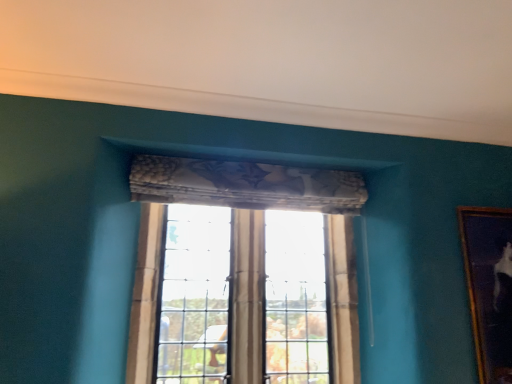
What do you see at coordinates (240, 273) in the screenshot? The image size is (512, 384). I see `clear glass window at center` at bounding box center [240, 273].

At what (x,y) coordinates should I click in order to perform the action: click on clear glass window at center. Please return your answer as a coordinate pair (x, y). Looking at the image, I should click on (240, 273).

Image resolution: width=512 pixels, height=384 pixels. Describe the element at coordinates (489, 287) in the screenshot. I see `gold-framed painting at right` at that location.

You are a GUI agent. You are given a task and a screenshot of the screen. Output one action in this format:
    pyautogui.click(x=<x>, y=<y>)
    Task: Click on the gold-framed painting at right
    
    Given the screenshot: What is the action you would take?
    pyautogui.click(x=489, y=287)

Measure the distance between point (494, 363) and camera.

Point (494, 363) and camera are 2.28 meters apart.

Locate an element on the screen. Image resolution: width=512 pixels, height=384 pixels. clear glass window at center is located at coordinates (240, 273).

Which is more to the right, gold-framed painting at right or clear glass window at center?

gold-framed painting at right is more to the right.

Is the depth of gold-framed painting at right less than that of clear glass window at center?

That is False.

Does point (482, 278) come closer to viewer compared to point (209, 380)?

Yes, it is in front of point (209, 380).

From the image's perspective, is gold-framed painting at right located above or below clear glass window at center?

From the image's perspective, gold-framed painting at right appears above clear glass window at center.

From a real-world perspective, is gold-framed painting at right under clear glass window at center?

No, from a real-world perspective, gold-framed painting at right is not under clear glass window at center.

Based on the photo, is gold-framed painting at right wider or thinner than clear glass window at center?

gold-framed painting at right is thinner than clear glass window at center.

Considering the sizes of objects gold-framed painting at right and clear glass window at center in the image provided, who is taller, gold-framed painting at right or clear glass window at center?

clear glass window at center.

Can you confirm if gold-framed painting at right is bigger than clear glass window at center?

No.

Consider the image. Is clear glass window at center located within gold-framed painting at right?

No.

Are gold-framed painting at right and clear glass window at center beside each other?

No, gold-framed painting at right is not touching clear glass window at center.

Is clear glass window at center at the back of gold-framed painting at right?

No, clear glass window at center is not at the back of gold-framed painting at right.

How many degrees apart are the facing directions of gold-framed painting at right and clear glass window at center?

The facing directions of gold-framed painting at right and clear glass window at center are 0.753 degrees apart.

How distant is gold-framed painting at right from clear glass window at center?

gold-framed painting at right is 1.08 meters away from clear glass window at center.

At what (x,y) coordinates should I click in order to perform the action: click on picture frame located above the clear glass window at center (from the image's perspective). Please return your answer as a coordinate pair (x, y). This screenshot has width=512, height=384. Looking at the image, I should click on (489, 287).

Between clear glass window at center and gold-framed painting at right, which one appears on the right side from the viewer's perspective?

From the viewer's perspective, gold-framed painting at right appears more on the right side.

Is clear glass window at center closer to camera compared to gold-framed painting at right?

Yes, clear glass window at center is closer to the viewer.

Is point (142, 279) closer or farther from the camera than point (511, 274)?

Point (142, 279) is closer to the camera than point (511, 274).

From the image's perspective, which is above, clear glass window at center or gold-framed painting at right?

gold-framed painting at right, from the image's perspective.

From a real-world perspective, is clear glass window at center positioned under gold-framed painting at right based on gravity?

Yes, from a real-world perspective, clear glass window at center is under gold-framed painting at right.

Which object is thinner, clear glass window at center or gold-framed painting at right?

Thinner between the two is gold-framed painting at right.

Does clear glass window at center have a greater height compared to gold-framed painting at right?

Indeed, clear glass window at center has a greater height compared to gold-framed painting at right.

Can you confirm if clear glass window at center is bigger than gold-framed painting at right?

Indeed, clear glass window at center has a larger size compared to gold-framed painting at right.

Is clear glass window at center inside the boundaries of gold-framed painting at right, or outside?

clear glass window at center lies outside gold-framed painting at right.

Is clear glass window at center touching gold-framed painting at right?

There is a gap between clear glass window at center and gold-framed painting at right.

Looking at this image, is clear glass window at center facing away from gold-framed painting at right?

That's not correct — clear glass window at center is not looking away from gold-framed painting at right.

How different are the orientations of clear glass window at center and gold-framed painting at right in degrees?

clear glass window at center and gold-framed painting at right are facing 0.753 degrees away from each other.

Where is `picture frame behind the clear glass window at center`? This screenshot has height=384, width=512. picture frame behind the clear glass window at center is located at coordinates (489, 287).

The width and height of the screenshot is (512, 384). I want to click on picture frame above the clear glass window at center (from the image's perspective), so click(489, 287).

The width and height of the screenshot is (512, 384). I want to click on window on the left of the gold-framed painting at right, so click(240, 273).